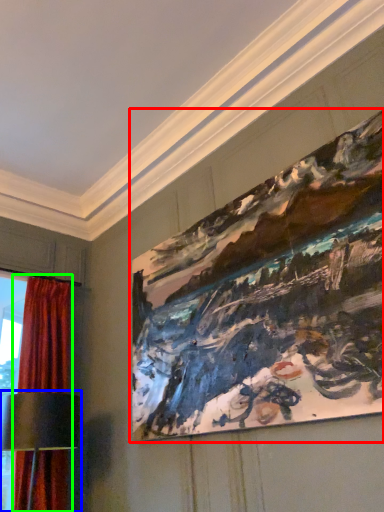
Question: Based on their relative distances, which object is farther from picture frame (highlighted by a red box)? Choose from table lamp (highlighted by a blue box) and curtain (highlighted by a green box).

Choices:
 (A) table lamp
 (B) curtain

Answer: (B)